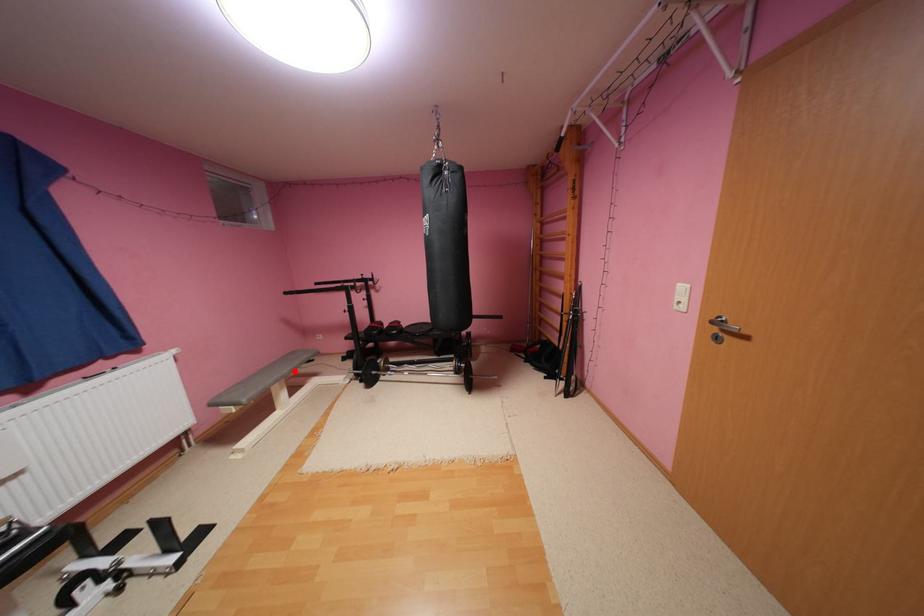
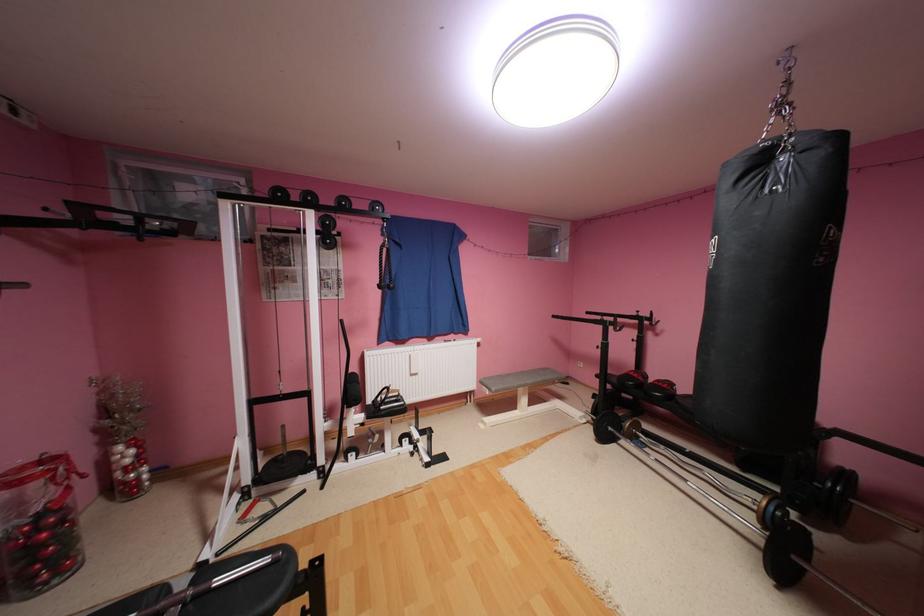
Question: I am providing you with two images of the same scene from different viewpoints. A red point is marked on the first image. Can you still see the location of the red point in image 2?

Choices:
 (A) Yes
 (B) No

Answer: (A)